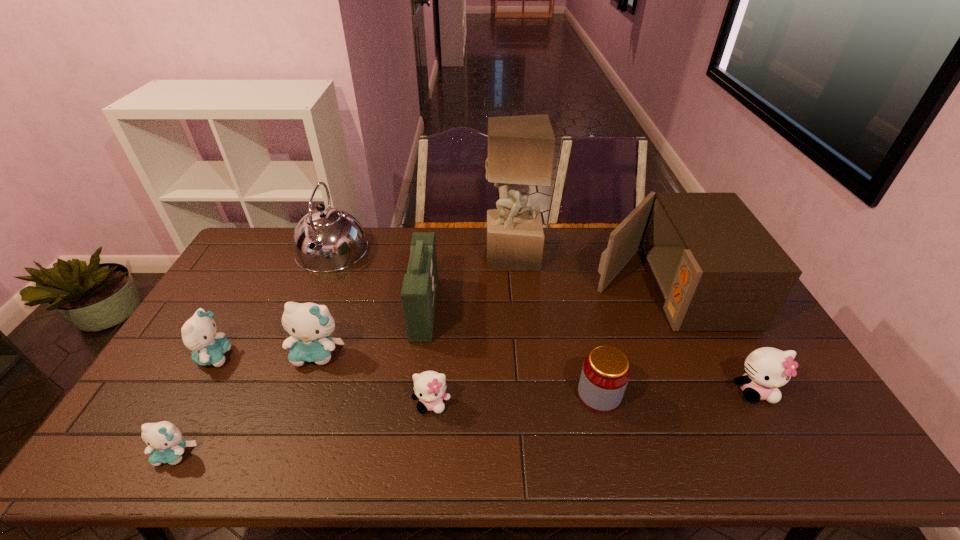
I want to click on sculpture, so click(521, 148).

Identify the location of gray sculpture. This screenshot has height=540, width=960. (521, 148).

Where is `kettle`? The image size is (960, 540). kettle is located at coordinates [x=327, y=239].

Identify the location of brown microwave oven. Image resolution: width=960 pixels, height=540 pixels. click(x=718, y=269).

This screenshot has width=960, height=540. I want to click on the first-aid kit, so click(419, 290).

This screenshot has width=960, height=540. I want to click on the biggest blue kitten, so click(x=310, y=325).

Where is `the third kitten from right to left`? the third kitten from right to left is located at coordinates (310, 325).

Identify the location of the second smallest blue kitten. (199, 335).

Identify the location of the right white kitten. (766, 369).

Image resolution: width=960 pixels, height=540 pixels. In order to click on the bigger white kitten in this screenshot , I will do `click(766, 369)`.